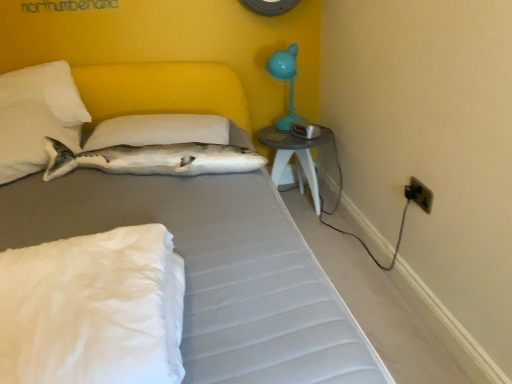
In order to click on white soft pillow at upper left, which ranks as the 2th pillow in back-to-front order in this screenshot , I will do `click(37, 116)`.

What do you see at coordinates (93, 309) in the screenshot? I see `white soft pillow at lower left, which ranks as the first pillow in front-to-back order` at bounding box center [93, 309].

What is the approximate width of white plush fish at upper left?

The width of white plush fish at upper left is 13.20 inches.

Find the location of `black plastic electrical outlet at lower right`. black plastic electrical outlet at lower right is located at coordinates (421, 195).

Where is `white soft pillow at upper left, which ranks as the second pillow in front-to-back order`? This screenshot has width=512, height=384. white soft pillow at upper left, which ranks as the second pillow in front-to-back order is located at coordinates pyautogui.click(x=37, y=116).

Relative to teal plastic table lamp at upper right, is gray fabric bed at center in front or behind?

gray fabric bed at center is positioned closer to the viewer than teal plastic table lamp at upper right.

Are gray fabric bed at center and teal plastic table lamp at upper right far apart?

Indeed, gray fabric bed at center is not near teal plastic table lamp at upper right.

Between gray fabric bed at center and teal plastic table lamp at upper right, which one has larger size?

gray fabric bed at center is bigger.

From the image's perspective, is gray fabric bed at center beneath teal plastic table lamp at upper right?

Indeed, from the image's perspective, gray fabric bed at center is shown beneath teal plastic table lamp at upper right.

Considering the positions of point (51, 107) and point (134, 251), is point (51, 107) closer or farther from the camera than point (134, 251)?

Point (51, 107) is positioned farther from the camera compared to point (134, 251).

From the image's perspective, relative to white soft pillow at lower left, which ranks as the first pillow in front-to-back order, is white soft pillow at upper left, which ranks as the second pillow in front-to-back order, above or below?

white soft pillow at upper left, which ranks as the second pillow in front-to-back order, is above white soft pillow at lower left, which ranks as the first pillow in front-to-back order.

Based on the photo, is white soft pillow at upper left, which ranks as the second pillow in front-to-back order, positioned far away from white soft pillow at lower left, the third pillow viewed from the back?

Absolutely, white soft pillow at upper left, which ranks as the second pillow in front-to-back order, is distant from white soft pillow at lower left, the third pillow viewed from the back.

Is white soft pillow at upper center, which ranks as the 3th pillow in front-to-back order, facing away from gray fabric bed at center?

Correct, white soft pillow at upper center, which ranks as the 3th pillow in front-to-back order, is looking away from gray fabric bed at center.

Could you measure the distance between white soft pillow at upper center, which ranks as the 3th pillow in front-to-back order, and gray fabric bed at center?

A distance of 16.69 inches exists between white soft pillow at upper center, which ranks as the 3th pillow in front-to-back order, and gray fabric bed at center.

Does white soft pillow at upper center, which ranks as the 3th pillow in front-to-back order, have a greater width compared to gray fabric bed at center?

Incorrect, the width of white soft pillow at upper center, which ranks as the 3th pillow in front-to-back order, does not surpass that of gray fabric bed at center.

Where is `pillow that is the 1st one above the gray fabric bed at center (from a real-world perspective)`? The image size is (512, 384). pillow that is the 1st one above the gray fabric bed at center (from a real-world perspective) is located at coordinates (159, 130).

From a real-world perspective, is white plush fish at upper left on top of matte gray table at right?

Yes.

Is white plush fish at upper left inside the boundaries of matte gray table at right, or outside?

white plush fish at upper left is spatially situated outside matte gray table at right.

Could you tell me if white plush fish at upper left is facing matte gray table at right?

No, white plush fish at upper left is not turned towards matte gray table at right.

Looking at this image, could you tell me if black plastic electrical outlet at lower right is turned towards white soft pillow at upper center, which ranks as the 3th pillow in front-to-back order?

No, black plastic electrical outlet at lower right is not aimed at white soft pillow at upper center, which ranks as the 3th pillow in front-to-back order.

Would you consider black plastic electrical outlet at lower right to be distant from white soft pillow at upper center, which ranks as the 3th pillow in front-to-back order?

Absolutely, black plastic electrical outlet at lower right is distant from white soft pillow at upper center, which ranks as the 3th pillow in front-to-back order.

Does point (426, 204) lie in front of point (129, 126)?

Yes, it is.

Would you say white soft pillow at upper center, which is counted as the 1th pillow, starting from the back, is part of black plastic electrical outlet at lower right's contents?

Definitely not — white soft pillow at upper center, which is counted as the 1th pillow, starting from the back, is not inside black plastic electrical outlet at lower right.

Consider the image. From the image's perspective, which is above, matte gray table at right or black plastic electrical outlet at lower right?

matte gray table at right.

Is matte gray table at right located outside black plastic electrical outlet at lower right?

Yes, matte gray table at right is not within black plastic electrical outlet at lower right.

Does matte gray table at right turn towards black plastic electrical outlet at lower right?

Yes, matte gray table at right faces towards black plastic electrical outlet at lower right.

Can you tell me how much matte gray table at right and black plastic electrical outlet at lower right differ in facing direction?

87.9 degrees.

Is gray fabric bed at center bigger or smaller than white soft pillow at upper center, which is counted as the 1th pillow, starting from the back?

gray fabric bed at center is bigger than white soft pillow at upper center, which is counted as the 1th pillow, starting from the back.

Is gray fabric bed at center in front of or behind white soft pillow at upper center, which is counted as the 1th pillow, starting from the back, in the image?

gray fabric bed at center is in front of white soft pillow at upper center, which is counted as the 1th pillow, starting from the back.

Is gray fabric bed at center facing away from white soft pillow at upper center, which is counted as the 1th pillow, starting from the back?

Yes.

From a real-world perspective, count 1st pillows upward from the gray fabric bed at center and point to it. Please provide its 2D coordinates.

[(159, 130)]

The image size is (512, 384). I want to click on table lamp above the gray fabric bed at center (from the image's perspective), so click(285, 80).

This screenshot has width=512, height=384. I want to click on the 1st pillow directly beneath the white soft pillow at upper left, which ranks as the second pillow in front-to-back order (from a real-world perspective), so click(x=93, y=309).

From the image, which object appears to be farther from matte gray table at right, white soft pillow at lower left, which ranks as the first pillow in front-to-back order, or white soft pillow at upper center, which is counted as the 1th pillow, starting from the back?

white soft pillow at lower left, which ranks as the first pillow in front-to-back order, is further to matte gray table at right.

Consider the image. From the image, which object appears to be nearer to white soft pillow at lower left, which ranks as the first pillow in front-to-back order, white soft pillow at upper left, which ranks as the second pillow in front-to-back order, or white plush fish at upper left?

white plush fish at upper left lies closer to white soft pillow at lower left, which ranks as the first pillow in front-to-back order, than the other object.

Which object lies further to the anchor point white soft pillow at upper left, which ranks as the second pillow in front-to-back order, teal plastic table lamp at upper right or white soft pillow at upper center, which is counted as the 1th pillow, starting from the back?

Among the two, teal plastic table lamp at upper right is located further to white soft pillow at upper left, which ranks as the second pillow in front-to-back order.

When comparing their distances from white soft pillow at upper center, which ranks as the 3th pillow in front-to-back order, does white plush fish at upper left or teal plastic table lamp at upper right seem further?

teal plastic table lamp at upper right.

When comparing their distances from black plastic electrical outlet at lower right, does white soft pillow at upper center, which is counted as the 1th pillow, starting from the back, or white soft pillow at lower left, the third pillow viewed from the back, seem closer?

Among the two, white soft pillow at upper center, which is counted as the 1th pillow, starting from the back, is located nearer to black plastic electrical outlet at lower right.

Which object lies nearer to the anchor point white plush fish at upper left, gray fabric bed at center or white soft pillow at lower left, which ranks as the first pillow in front-to-back order?

gray fabric bed at center is closer to white plush fish at upper left.

Looking at the image, which one is located further to gray fabric bed at center, teal plastic table lamp at upper right or white plush fish at upper left?

teal plastic table lamp at upper right.

Looking at the image, which one is located further to matte gray table at right, white plush fish at upper left or teal plastic table lamp at upper right?

white plush fish at upper left is positioned further to the anchor matte gray table at right.

Find the location of a particular element. This screenshot has height=384, width=512. fish situated between white soft pillow at upper center, which ranks as the 3th pillow in front-to-back order, and matte gray table at right from left to right is located at coordinates (154, 159).

Locate an element on the screen. Image resolution: width=512 pixels, height=384 pixels. table situated between white soft pillow at upper center, which is counted as the 1th pillow, starting from the back, and black plastic electrical outlet at lower right from left to right is located at coordinates (296, 157).

The width and height of the screenshot is (512, 384). In order to click on electric outlet located between white soft pillow at lower left, the third pillow viewed from the back, and teal plastic table lamp at upper right in the depth direction in this screenshot , I will do `click(421, 195)`.

Image resolution: width=512 pixels, height=384 pixels. In order to click on pillow between gray fabric bed at center and white soft pillow at upper left, which ranks as the 2th pillow in back-to-front order, from front to back in this screenshot , I will do click(x=93, y=309).